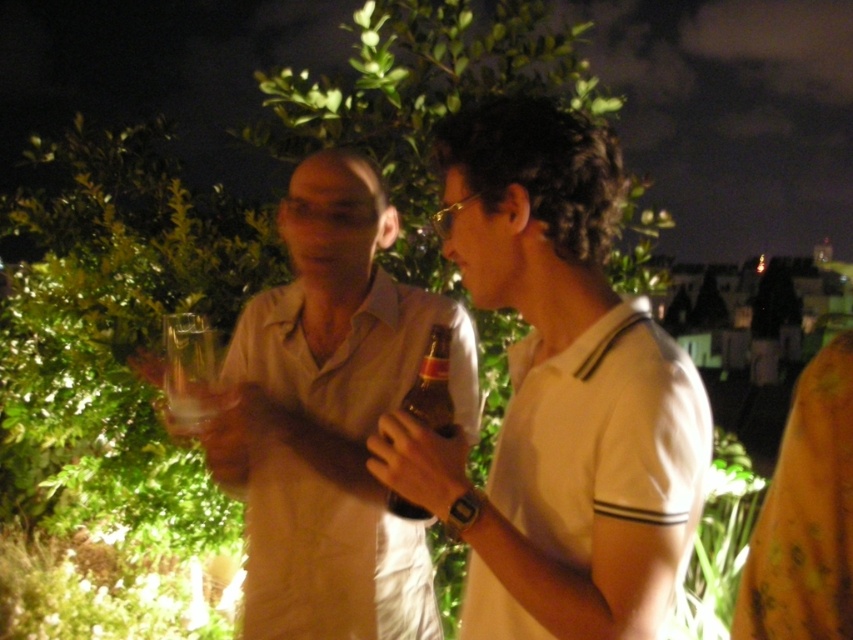
Question: Which object is positioned closest to the white cotton shirt at center?

Choices:
 (A) clear glass at center
 (B) brown glass bottle at center

Answer: (B)

Question: Which object is the farthest from the white cotton shirt at center?

Choices:
 (A) matte beige shirt at center
 (B) brown glass bottle at center

Answer: (A)

Question: Does matte beige shirt at center appear over clear glass at center?

Choices:
 (A) no
 (B) yes

Answer: (A)

Question: Is clear glass at center bigger than brown glass bottle at center?

Choices:
 (A) no
 (B) yes

Answer: (A)

Question: Is clear glass at center below brown glass bottle at center?

Choices:
 (A) no
 (B) yes

Answer: (A)

Question: Which of the following is the farthest from the observer?

Choices:
 (A) (287, 404)
 (B) (584, 323)

Answer: (A)